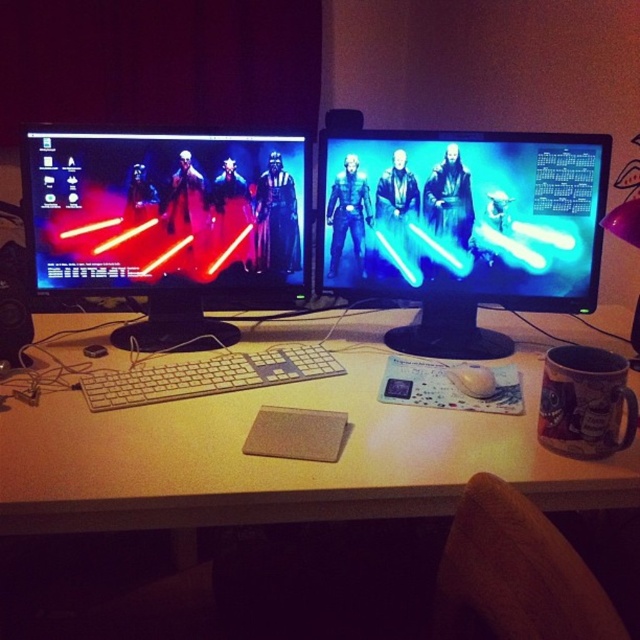
Question: Which point appears closest to the camera in this image?

Choices:
 (A) click(99, 333)
 (B) click(467, 385)
 (C) click(257, 205)

Answer: (B)

Question: Can you confirm if white plastic keyboard at center is positioned to the right of white matte mouse at center?

Choices:
 (A) yes
 (B) no

Answer: (B)

Question: Which point appears closest to the camera in this image?

Choices:
 (A) (189, 387)
 (B) (474, 388)

Answer: (B)

Question: Can you confirm if white plastic keyboard at center is wider than white matte mouse at center?

Choices:
 (A) no
 (B) yes

Answer: (B)

Question: Is blue glossy lightsaber at center above white matte mouse at center?

Choices:
 (A) yes
 (B) no

Answer: (A)

Question: Based on their relative distances, which object is nearer to the white matte mouse at center?

Choices:
 (A) white plastic keyboard at center
 (B) matte black monitor at left

Answer: (A)